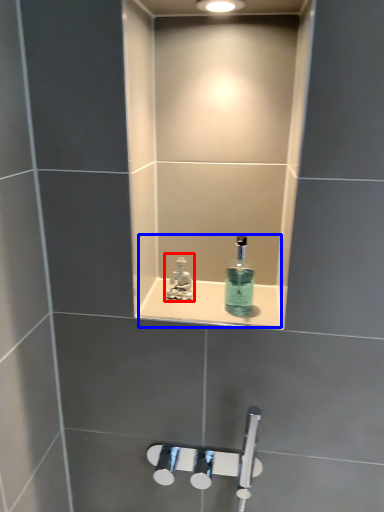
Question: Which point is closer to the camera, tap (highlighted by a red box) or sink (highlighted by a blue box)?

Choices:
 (A) tap
 (B) sink

Answer: (B)